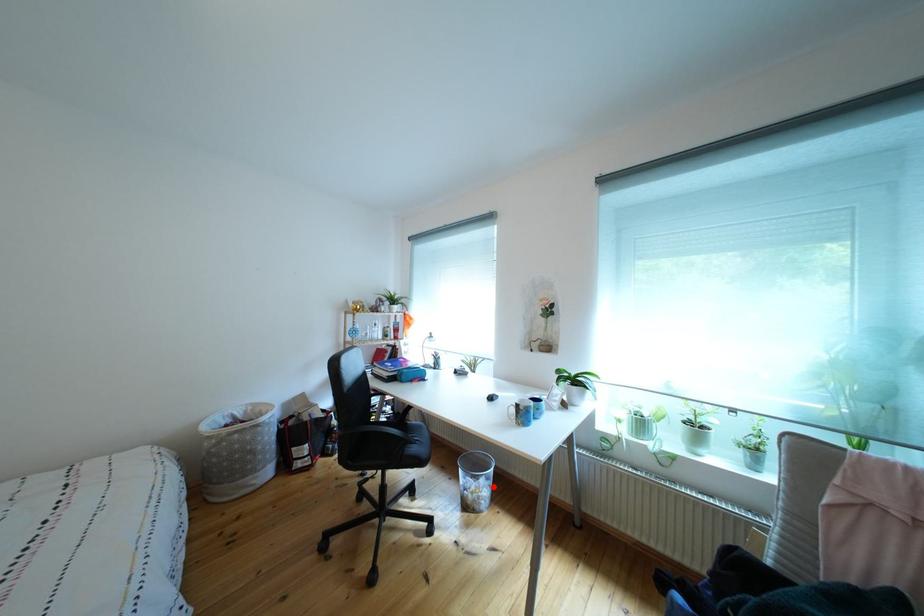
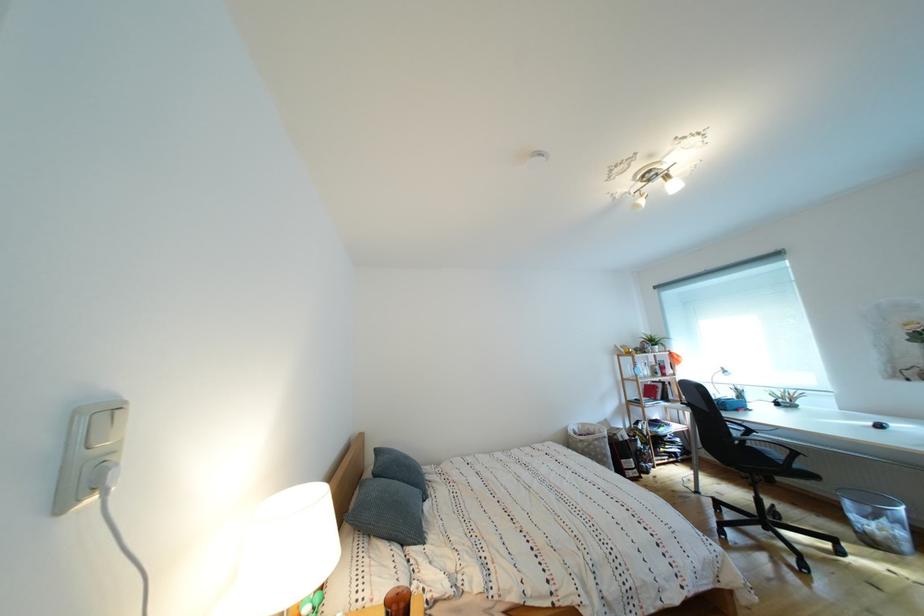
Question: I am providing you with two images of the same scene from different viewpoints. A red point is shown in image1. For the corresponding object point in image2, is it positioned nearer or farther from the camera?

Choices:
 (A) Nearer
 (B) Farther

Answer: (A)